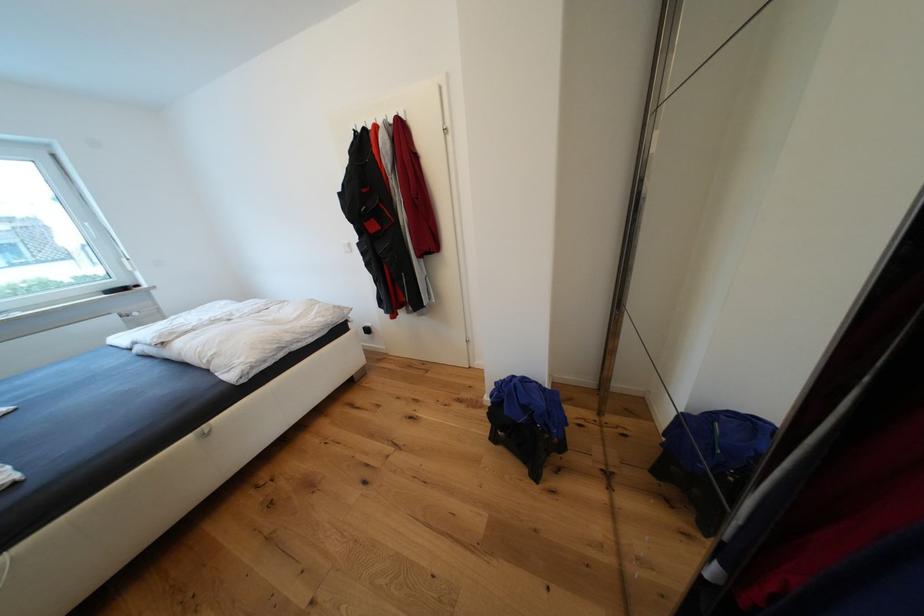
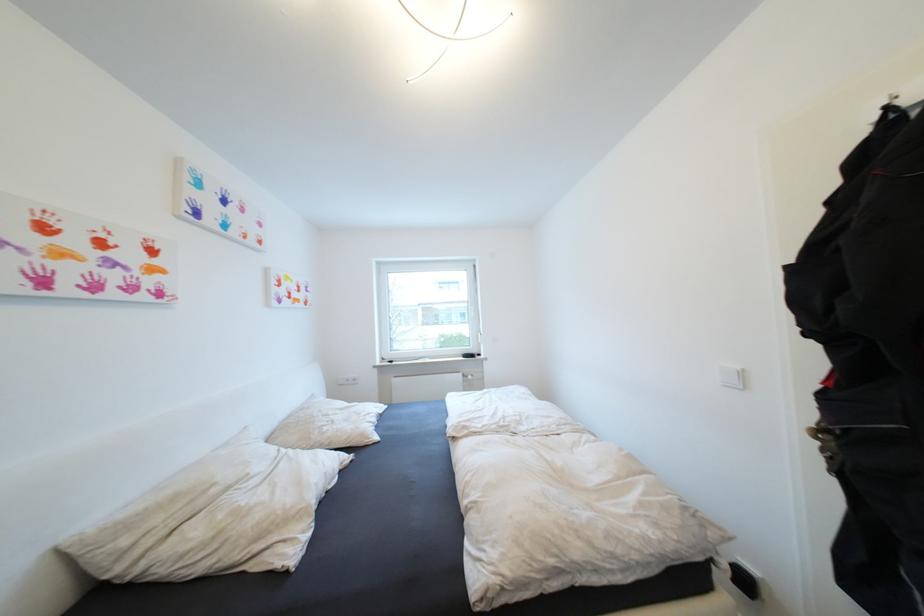
Question: The first image is from the beginning of the video and the second image is from the end. How did the camera likely rotate when shooting the video?

Choices:
 (A) Left
 (B) Right
 (C) Up
 (D) Down

Answer: (A)